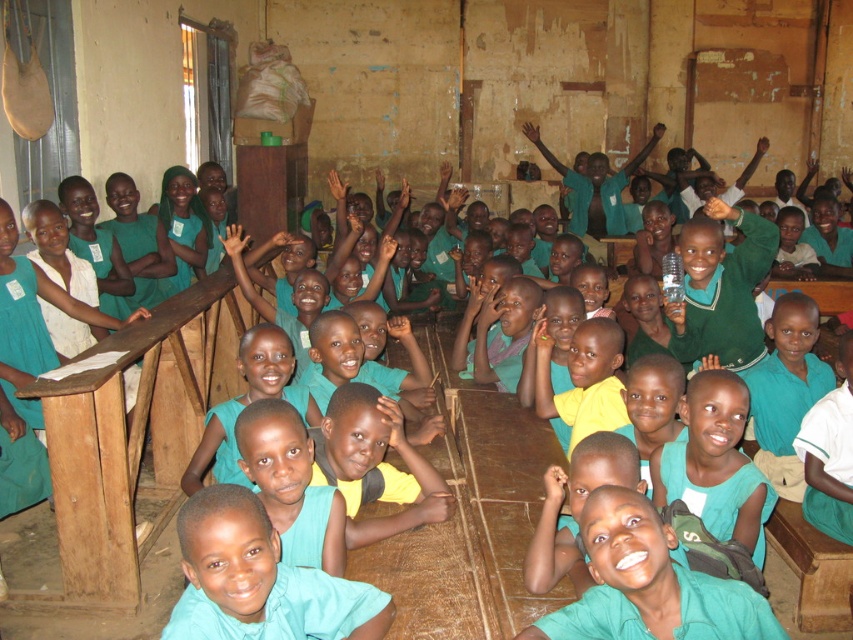
Question: Among these points, which one is farthest from the camera?

Choices:
 (A) (833, 444)
 (B) (318, 460)
 (C) (735, 342)

Answer: (C)

Question: Which of the following is the closest to the observer?

Choices:
 (A) green uniform shirt at center
 (B) matte green shirt at center
 (C) teal matte shirt at center

Answer: (C)

Question: Does yellow matte shirt at center have a greater width compared to dark brown wood hand at lower center?

Choices:
 (A) no
 (B) yes

Answer: (B)

Question: Which point is closer to the camera?

Choices:
 (A) tap(215, 504)
 (B) tap(434, 493)
 (C) tap(300, 508)
 (D) tap(563, 529)

Answer: (A)

Question: Can you confirm if yellow matte shirt at center is thinner than matte green shirt at center?

Choices:
 (A) no
 (B) yes

Answer: (A)

Question: Is green matte shirt at lower right to the left of matte green shirt at lower center from the viewer's perspective?

Choices:
 (A) yes
 (B) no

Answer: (B)